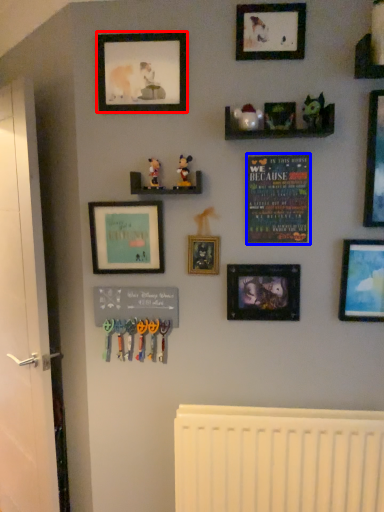
Question: Which of the following is the farthest to the observer, picture frame (highlighted by a red box) or bulletin board (highlighted by a blue box)?

Choices:
 (A) picture frame
 (B) bulletin board

Answer: (B)